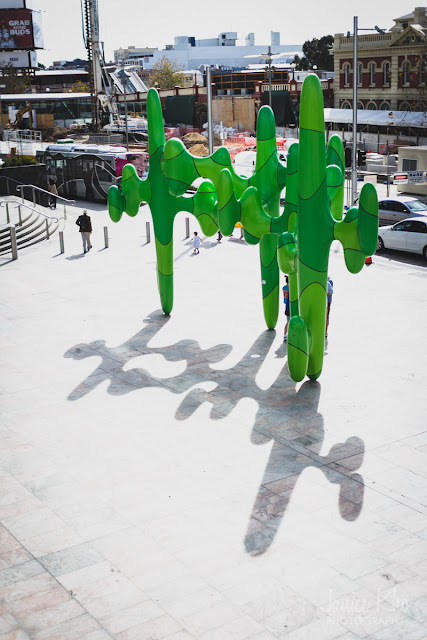
Locate an element on the screen. bannister is located at coordinates (23, 203), (35, 187).